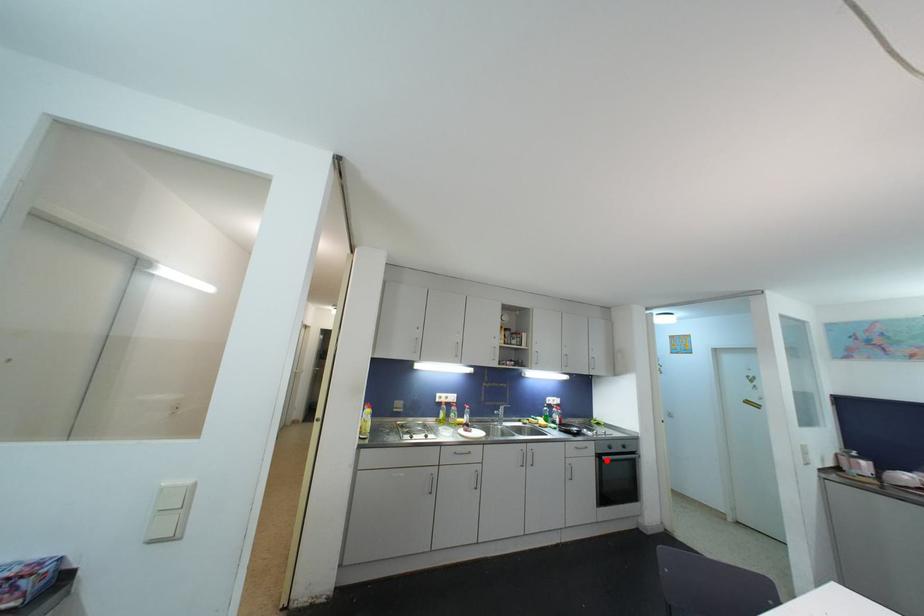
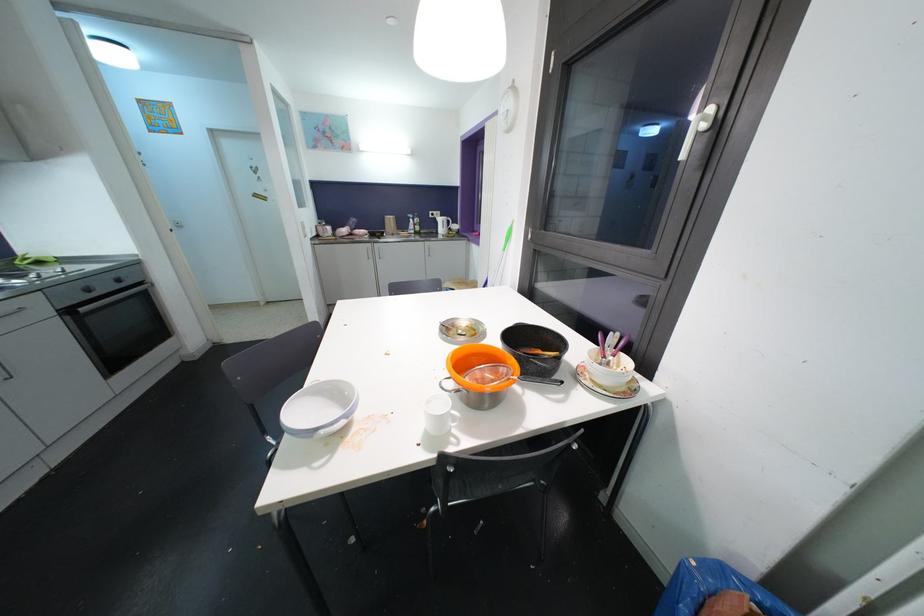
Question: A red point is marked in image1. In image2, is the corresponding 3D point closer to the camera or farther? Reply with the corresponding letter.

Choices:
 (A) The corresponding 3D point is closer.
 (B) The corresponding 3D point is farther.

Answer: (A)